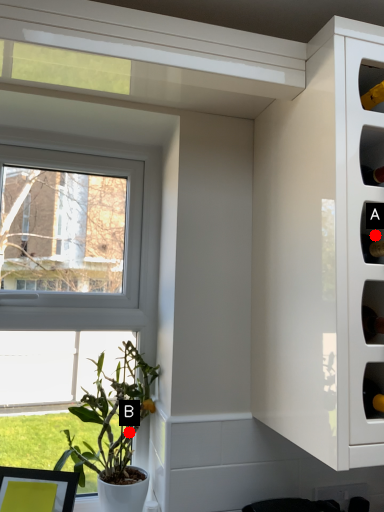
Question: Two points are circled on the image, labeled by A and B beside each circle. Which of the following is the closest to the observer?

Choices:
 (A) A is closer
 (B) B is closer

Answer: (A)